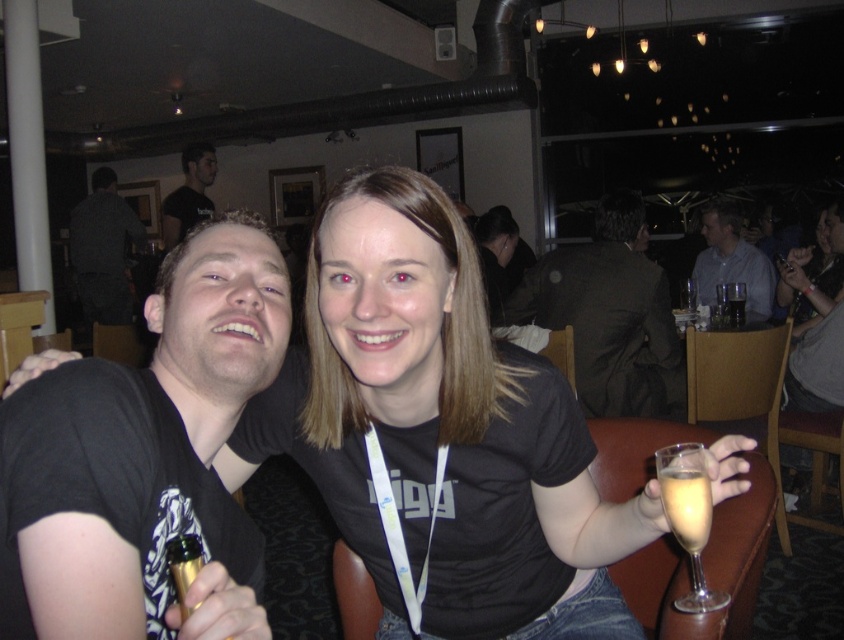
You are standing at the origin of the coordinate system in the image. The black t shirt at upper left is located at point (x=188, y=195). If you want to move towards the black t shirt at upper left, which direction should you move in terms of x and y coordinates?

To move towards the black t shirt at upper left located at coordinates (x=188, y=195) from the origin, you should move in the positive x and positive y direction.